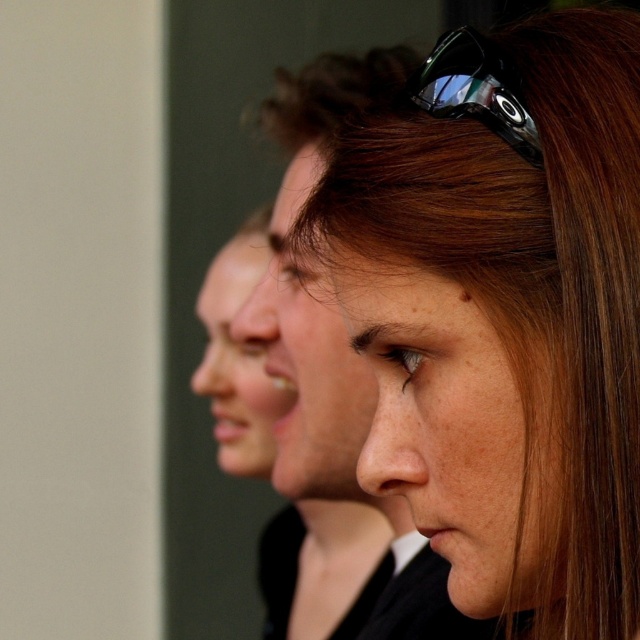
Question: Can you confirm if brown hair at center is positioned above black plastic sunglasses at upper center?

Choices:
 (A) no
 (B) yes

Answer: (A)

Question: Can you confirm if brown hair at center is wider than black plastic sunglasses at upper center?

Choices:
 (A) no
 (B) yes

Answer: (B)

Question: Which of the following is the farthest from the observer?

Choices:
 (A) brown hair at center
 (B) black plastic sunglasses at upper center

Answer: (B)

Question: Which point is closer to the camera?

Choices:
 (A) black plastic sunglasses at upper center
 (B) brown hair at center

Answer: (B)

Question: Is brown hair at center thinner than black plastic sunglasses at upper center?

Choices:
 (A) yes
 (B) no

Answer: (B)